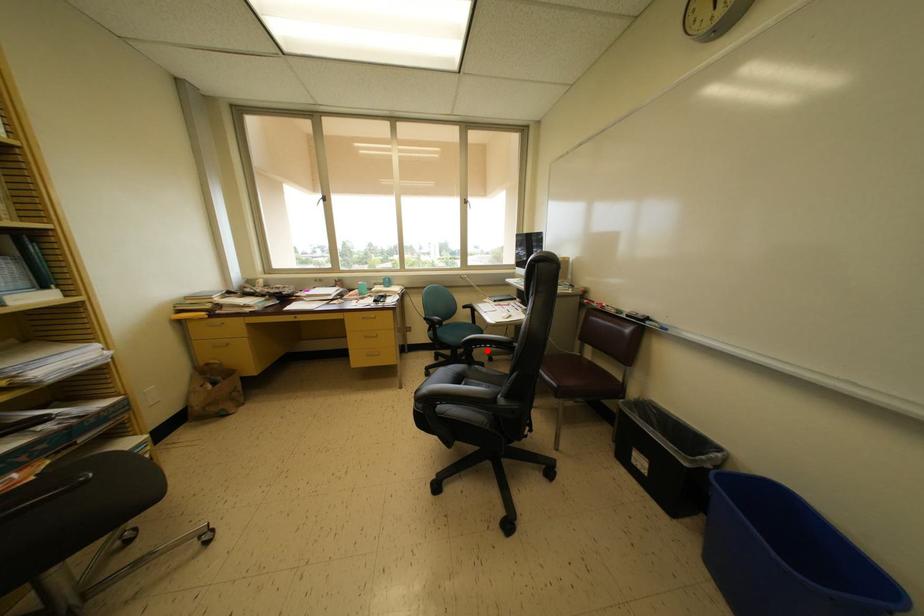
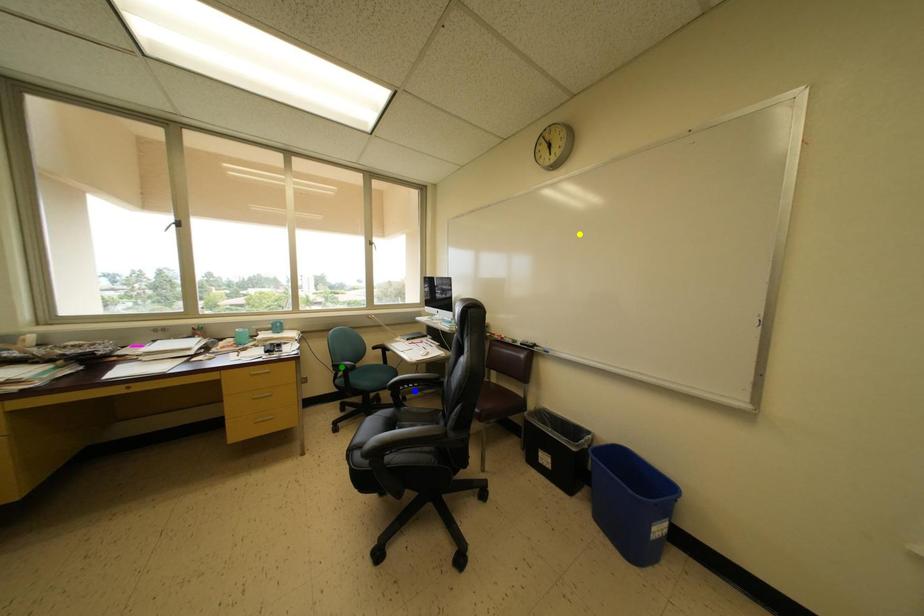
Question: I am providing you with two images of the same scene from different viewpoints. A red point is marked on the first image. You are given multiple points on the second image. Which spot in image 2 lines up with the point in image 1?

Choices:
 (A) blue point
 (B) green point
 (C) yellow point

Answer: (A)